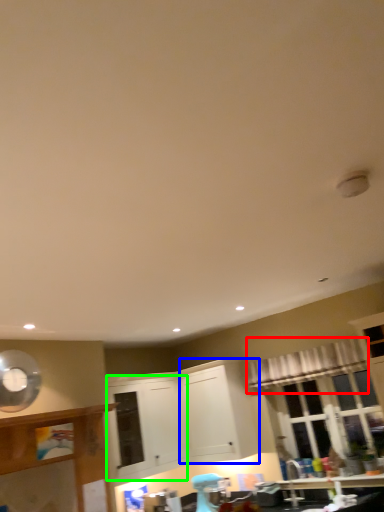
Question: Considering the real-world distances, which object is closest to curtain (highlighted by a red box)? cabinetry (highlighted by a blue box) or cabinetry (highlighted by a green box).

Choices:
 (A) cabinetry
 (B) cabinetry

Answer: (A)